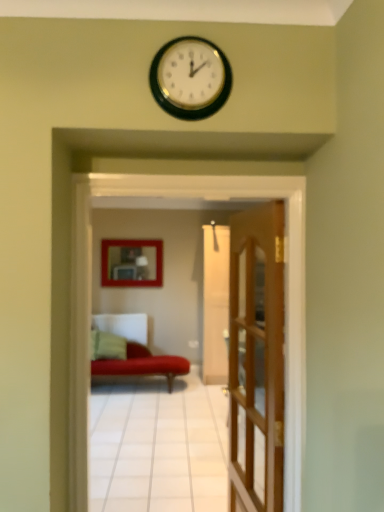
Question: Is wooden door at center facing away from matte wooden picture frame at center?

Choices:
 (A) yes
 (B) no

Answer: (B)

Question: Is wooden door at center behind matte wooden picture frame at center?

Choices:
 (A) no
 (B) yes

Answer: (A)

Question: Does wooden door at center turn towards matte wooden picture frame at center?

Choices:
 (A) yes
 (B) no

Answer: (B)

Question: From the image's perspective, does wooden door at center appear lower than matte wooden picture frame at center?

Choices:
 (A) no
 (B) yes

Answer: (B)

Question: Is wooden door at center at the right side of matte wooden picture frame at center?

Choices:
 (A) no
 (B) yes

Answer: (B)

Question: Based on their positions, is matte wooden picture frame at center located to the left or right of wooden door at center?

Choices:
 (A) left
 (B) right

Answer: (A)

Question: Relative to wooden door at center, is matte wooden picture frame at center in front or behind?

Choices:
 (A) front
 (B) behind

Answer: (B)

Question: Is matte wooden picture frame at center bigger or smaller than wooden door at center?

Choices:
 (A) small
 (B) big

Answer: (A)

Question: Would you say matte wooden picture frame at center is inside or outside wooden door at center?

Choices:
 (A) inside
 (B) outside

Answer: (B)

Question: Considering their positions, is velvet red couch at center located in front of or behind wooden door at center?

Choices:
 (A) front
 (B) behind

Answer: (A)

Question: Looking at the image, does velvet red couch at center seem bigger or smaller compared to wooden door at center?

Choices:
 (A) small
 (B) big

Answer: (A)

Question: Is velvet red couch at center spatially inside wooden door at center, or outside of it?

Choices:
 (A) inside
 (B) outside

Answer: (B)

Question: Is point (208, 189) positioned closer to the camera than point (266, 430)?

Choices:
 (A) closer
 (B) farther

Answer: (A)

Question: In the image, is matte wooden picture frame at center on the left side or the right side of velvet red couch at center?

Choices:
 (A) left
 (B) right

Answer: (A)

Question: Looking at their shapes, would you say matte wooden picture frame at center is wider or thinner than velvet red couch at center?

Choices:
 (A) thin
 (B) wide

Answer: (A)